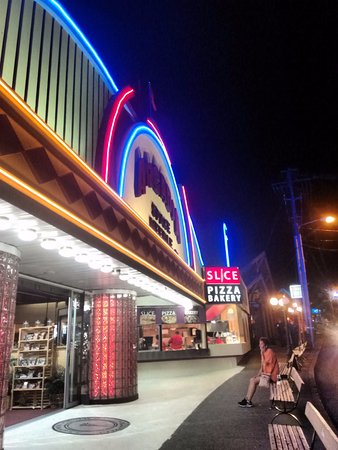
Identify the location of shelf. (47, 348).